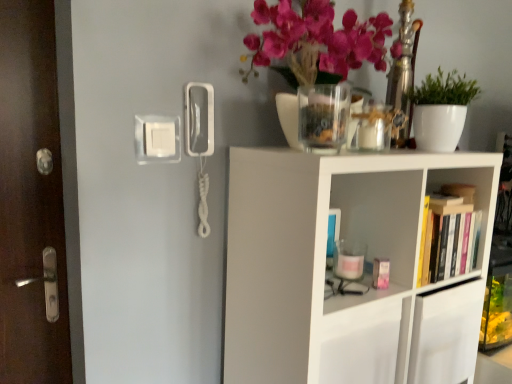
Image resolution: width=512 pixels, height=384 pixels. Describe the element at coordinates (30, 197) in the screenshot. I see `brown wooden door at left` at that location.

You are a GUI agent. You are given a task and a screenshot of the screen. Output one action in this format:
    pyautogui.click(x=<x>, y=<y>)
    Task: Click on the transparent glass jar at upper center
    The height and width of the screenshot is (384, 512).
    Given the screenshot: What is the action you would take?
    pyautogui.click(x=323, y=117)

This screenshot has width=512, height=384. I want to click on white matte shelf at upper right, so click(335, 277).

Locate an element on the screen. door above the white matte shelf at upper right (from the image's perspective) is located at coordinates (30, 197).

Would you say white matte shelf at upper right is part of brown wooden door at left's contents?

No, white matte shelf at upper right is not surrounded by brown wooden door at left.

Measure the distance between brown wooden door at left and white matte shelf at upper right.

A distance of 32.44 inches exists between brown wooden door at left and white matte shelf at upper right.

Looking at this image, could white matte plant at upper right be considered to be inside brown wooden door at left?

That's incorrect, white matte plant at upper right is not inside brown wooden door at left.

From the image's perspective, is brown wooden door at left above or below white matte plant at upper right?

From the image's perspective, brown wooden door at left appears below white matte plant at upper right.

Could you tell me if brown wooden door at left is facing white matte plant at upper right?

No, brown wooden door at left is not aimed at white matte plant at upper right.

Between white matte plant at upper right and brown wooden door at left, which one appears on the left side from the viewer's perspective?

brown wooden door at left.

Considering their positions, is white matte plant at upper right located in front of or behind brown wooden door at left?

Visually, white matte plant at upper right is located behind brown wooden door at left.

At what (x,y) coordinates should I click in order to perform the action: click on houseplant lying above the brown wooden door at left (from the image's perspective). Please return your answer as a coordinate pair (x, y). This screenshot has width=512, height=384. Looking at the image, I should click on (441, 110).

Can you confirm if white matte plant at upper right is thinner than brown wooden door at left?

No, white matte plant at upper right is not thinner than brown wooden door at left.

From the image's perspective, does transparent glass jar at upper center appear higher than brown wooden door at left?

Yes.

Does transparent glass jar at upper center have a larger size compared to brown wooden door at left?

No.

Measure the distance between transparent glass jar at upper center and brown wooden door at left.

transparent glass jar at upper center is 31.74 inches from brown wooden door at left.

How distant is white matte shelf at upper right from white matte plant at upper right?

white matte shelf at upper right and white matte plant at upper right are 15.95 inches apart.

Is white matte shelf at upper right closer to camera compared to white matte plant at upper right?

Yes.

Which object is wider, white matte shelf at upper right or white matte plant at upper right?

→ Wider between the two is white matte shelf at upper right.

Is brown wooden door at left closer to the viewer compared to hardcover book at right?

Yes.

Who is bigger, brown wooden door at left or hardcover book at right?

brown wooden door at left is bigger.

Is brown wooden door at left directly adjacent to hardcover book at right?

brown wooden door at left and hardcover book at right are clearly separated.

Would you say transparent glass jar at upper center is a long distance from white matte plant at upper right?

No, there isn't a large distance between transparent glass jar at upper center and white matte plant at upper right.

What's the angular difference between transparent glass jar at upper center and white matte plant at upper right's facing directions?

0.000535 degrees separate the facing orientations of transparent glass jar at upper center and white matte plant at upper right.

Does transparent glass jar at upper center come in front of white matte plant at upper right?

Yes, it is.

Which is more to the left, transparent glass jar at upper center or white matte plant at upper right?

transparent glass jar at upper center is more to the left.

The image size is (512, 384). What are the coordinates of `shelf on the right of brown wooden door at left` in the screenshot? It's located at (335, 277).

Identify the location of houseplant above the brown wooden door at left (from a real-world perspective). (441, 110).

When comparing their distances from white matte plant at upper right, does white matte shelf at upper right or transparent glass jar at upper center seem closer?

The object closer to white matte plant at upper right is transparent glass jar at upper center.

Estimate the real-world distances between objects in this image. Which object is closer to transparent glass jar at upper center, white matte plant at upper right or white matte shelf at upper right?

The object closer to transparent glass jar at upper center is white matte plant at upper right.

From the image, which object appears to be farther from hardcover book at right, brown wooden door at left or white matte shelf at upper right?

The object further to hardcover book at right is brown wooden door at left.

Considering their positions, is white matte shelf at upper right positioned further to transparent glass jar at upper center than white matte plant at upper right?

white matte shelf at upper right is positioned further to the anchor transparent glass jar at upper center.

Estimate the real-world distances between objects in this image. Which object is closer to transparent glass jar at upper center, hardcover book at right or white matte plant at upper right?

white matte plant at upper right lies closer to transparent glass jar at upper center than the other object.

Based on the photo, looking at the image, which one is located closer to hardcover book at right, white matte shelf at upper right or brown wooden door at left?

white matte shelf at upper right is positioned closer to the anchor hardcover book at right.

Estimate the real-world distances between objects in this image. Which object is further from brown wooden door at left, hardcover book at right or transparent glass jar at upper center?

Based on the image, hardcover book at right appears to be further to brown wooden door at left.

When comparing their distances from transparent glass jar at upper center, does brown wooden door at left or hardcover book at right seem closer?

hardcover book at right.

This screenshot has width=512, height=384. Find the location of `houseplant between transparent glass jar at upper center and hardcover book at right from left to right`. houseplant between transparent glass jar at upper center and hardcover book at right from left to right is located at coordinates (441, 110).

Locate an element on the screen. The height and width of the screenshot is (384, 512). houseplant between brown wooden door at left and hardcover book at right in the horizontal direction is located at coordinates (441, 110).

This screenshot has width=512, height=384. Identify the location of shelf situated between brown wooden door at left and hardcover book at right from left to right. (335, 277).

Where is `glass vase located between brown wooden door at left and white matte plant at upper right in the left-right direction`? glass vase located between brown wooden door at left and white matte plant at upper right in the left-right direction is located at coordinates (323, 117).